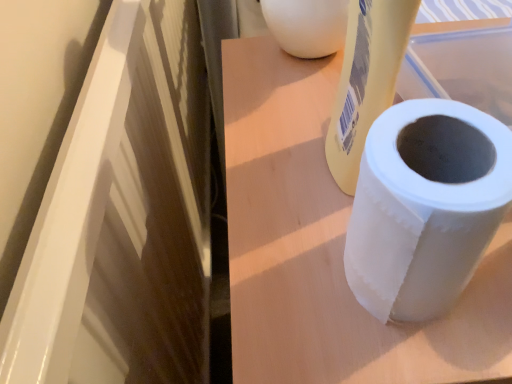
At what (x,y) coordinates should I click in order to perform the action: click on free space behind white matte toilet paper at right. Please return your answer as a coordinate pair (x, y). Looking at the image, I should click on (x=279, y=108).